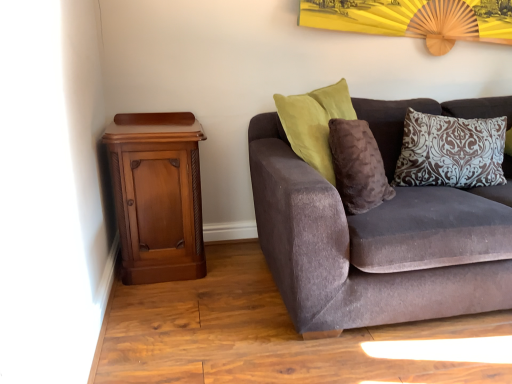
Identify the location of free space in front of polished wood nightstand at left. (166, 312).